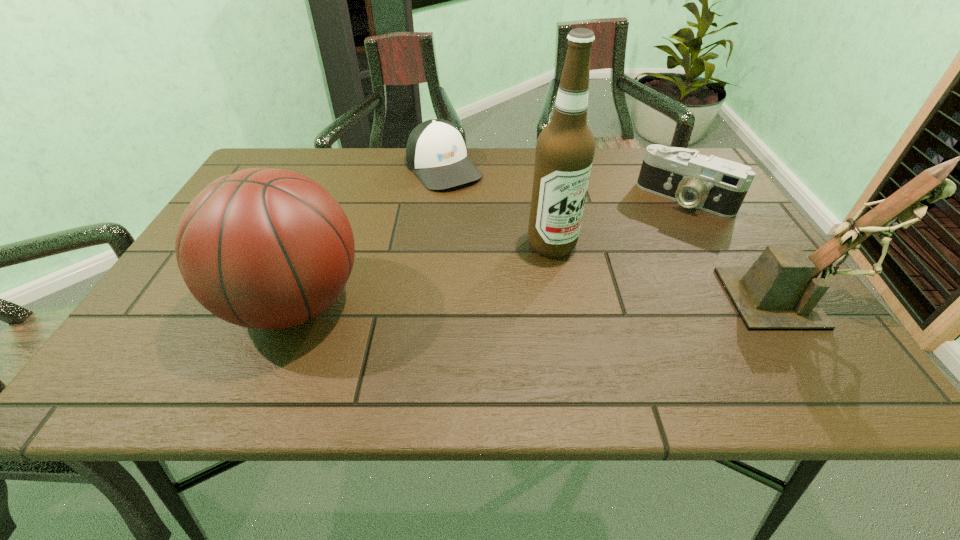
Where is `object positioned at the left edge`? The width and height of the screenshot is (960, 540). object positioned at the left edge is located at coordinates (264, 248).

Locate an element on the screen. figurine that is at the right edge is located at coordinates (781, 290).

Locate an element on the screen. This screenshot has height=540, width=960. camera situated at the right edge is located at coordinates (715, 185).

The image size is (960, 540). I want to click on object that is at the near left corner, so click(264, 248).

Locate an element on the screen. The image size is (960, 540). object at the far right corner is located at coordinates (715, 185).

In order to click on object that is at the near right corner in this screenshot , I will do `click(781, 290)`.

Locate an element on the screen. The image size is (960, 540). vacant area at the far edge of the desktop is located at coordinates (616, 147).

The image size is (960, 540). I want to click on vacant area at the far left corner, so click(289, 164).

I want to click on free space between the figurine and the camera, so click(x=740, y=248).

This screenshot has width=960, height=540. I want to click on free spot between the camera and the third object from left to right, so click(618, 222).